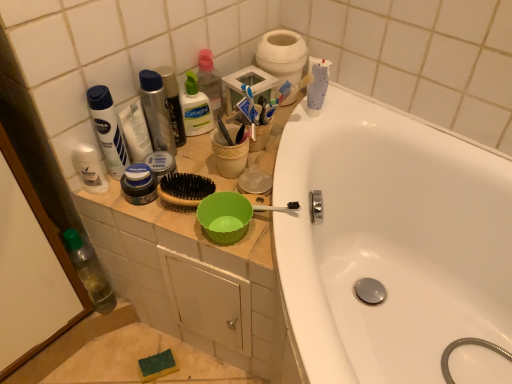
Question: Is white matte lotion at upper left, placed as the 2th toiletry when sorted from left to right, situated inside transparent plastic bottle at lower left or outside?

Choices:
 (A) outside
 (B) inside

Answer: (A)

Question: Is white matte lotion at upper left, which is the 2th toiletry in right-to-left order, in front of or behind transparent plastic bottle at lower left in the image?

Choices:
 (A) front
 (B) behind

Answer: (A)

Question: Estimate the real-world distances between objects in this image. Which object is farther from the metallic silver mouthwash at center, which ranks as the 1th mouthwash in right-to-left order?

Choices:
 (A) transparent plastic bottle at lower left
 (B) white matte tube at upper left, placed as the 2th toothpaste when sorted from top to bottom
 (C) white matte toilet paper at upper center
 (D) white matte toothpaste at upper right, which ranks as the 1th toothpaste in top-to-bottom order
 (E) clear plastic bottle at upper center, which ranks as the third toiletry in left-to-right order

Answer: (A)

Question: Which object is the farthest from the metallic silver mouthwash at center, the 2th mouthwash positioned from the left?

Choices:
 (A) white matte toilet paper at upper center
 (B) white matte lotion at upper left, placed as the 2th toiletry when sorted from left to right
 (C) clear plastic bottle at upper center, which ranks as the third toiletry in left-to-right order
 (D) transparent plastic bottle at lower left
 (E) translucent plastic bottle at upper center

Answer: (D)